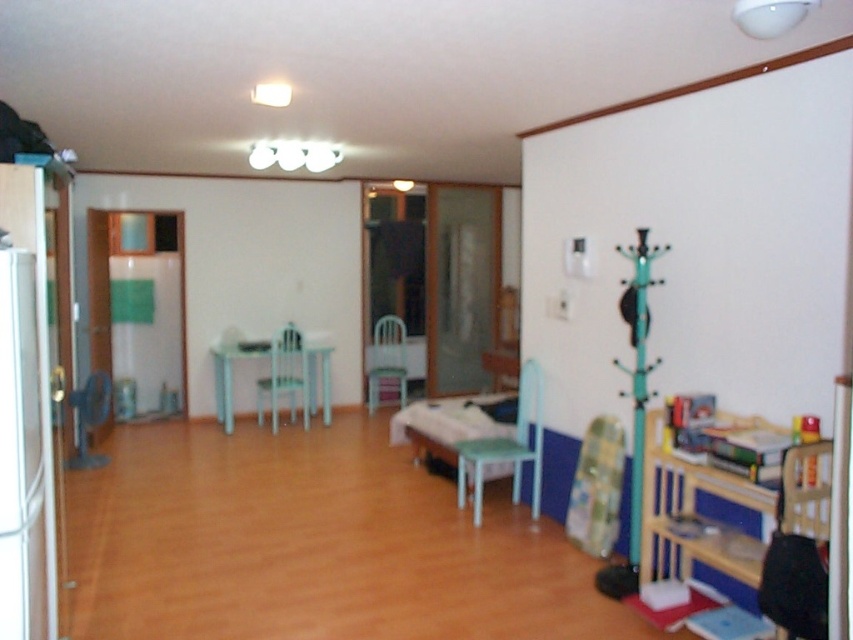
Is point (792, 467) in front of point (381, 346)?

Yes, it is.

How much distance is there between wooden bookshelf at right and green matte chair at center?

wooden bookshelf at right and green matte chair at center are 15.90 feet apart from each other.

What do you see at coordinates (695, 515) in the screenshot? This screenshot has width=853, height=640. I see `wooden bookshelf at right` at bounding box center [695, 515].

The width and height of the screenshot is (853, 640). I want to click on wooden bookshelf at right, so 695,515.

What do you see at coordinates (798, 554) in the screenshot? The width and height of the screenshot is (853, 640). I see `black fabric chair at lower right` at bounding box center [798, 554].

Does black fabric chair at lower right appear over matte plastic chair at center?

No, black fabric chair at lower right is not above matte plastic chair at center.

Based on the photo, who is more forward, (827, 616) or (271, 432)?

Point (827, 616) is more forward.

The image size is (853, 640). I want to click on black fabric chair at lower right, so click(x=798, y=554).

Is matte plastic chair at center closer to camera compared to green matte chair at center?

That is True.

Between point (280, 355) and point (370, 400), which one is positioned behind?

Point (370, 400)

Locate an element on the screen. matte plastic chair at center is located at coordinates (283, 376).